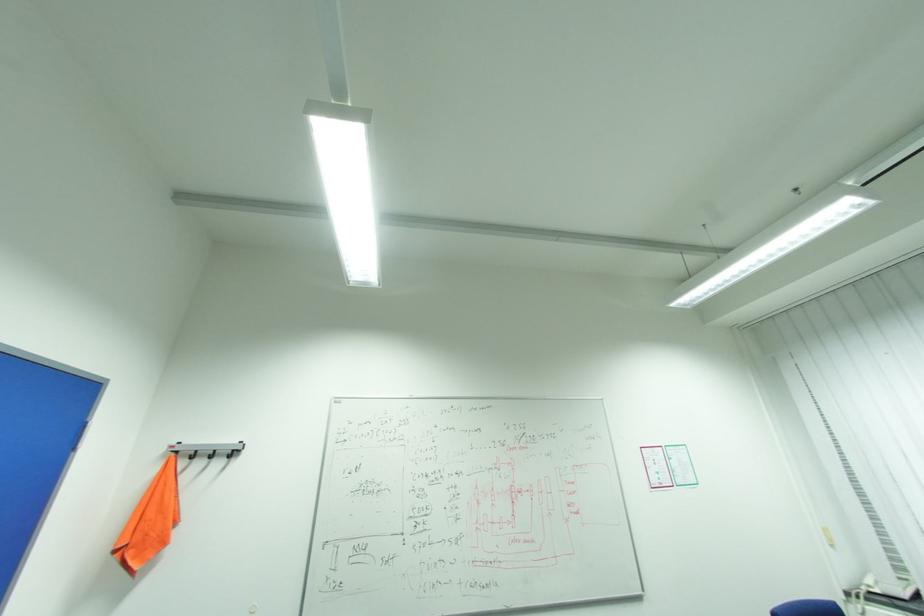
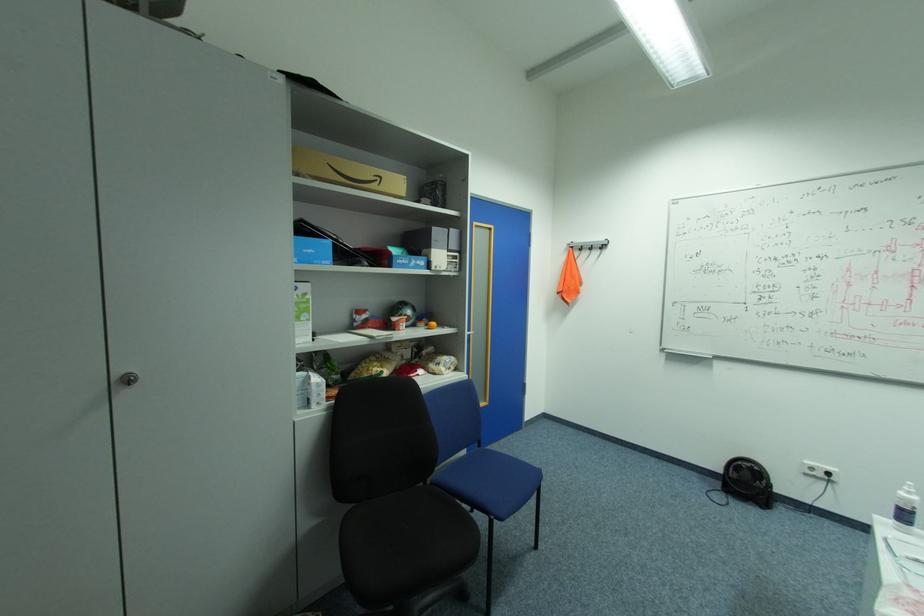
In the second image, find the point that corresponds to point 184,452 in the first image.

(578, 246)